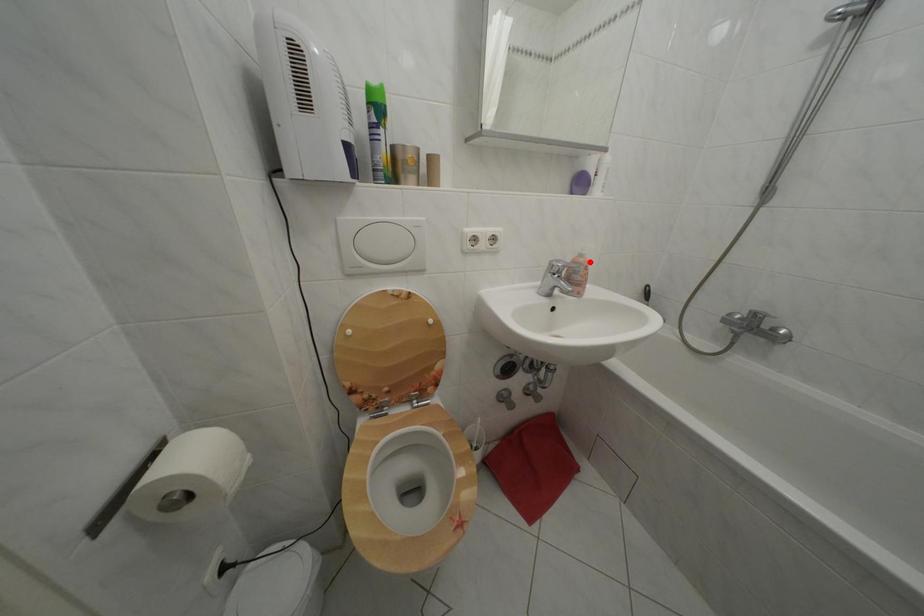
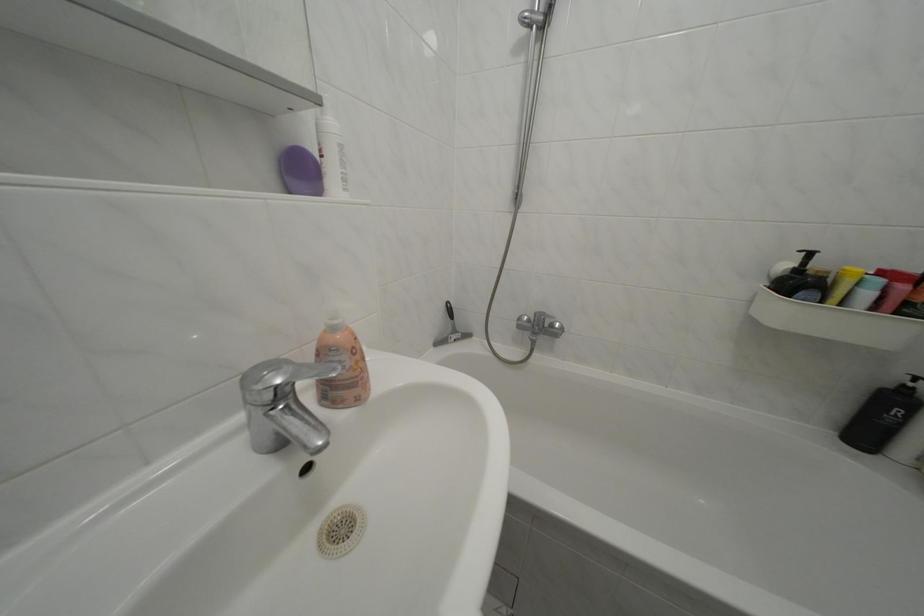
Find the pixel in the second image that matches the highlighted location in the first image.

(342, 334)